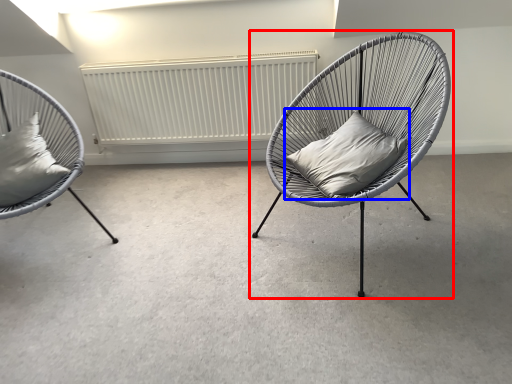
Question: Which object appears closest to the camera in this image, chair (highlighted by a red box) or pillow (highlighted by a blue box)?

Choices:
 (A) chair
 (B) pillow

Answer: (A)